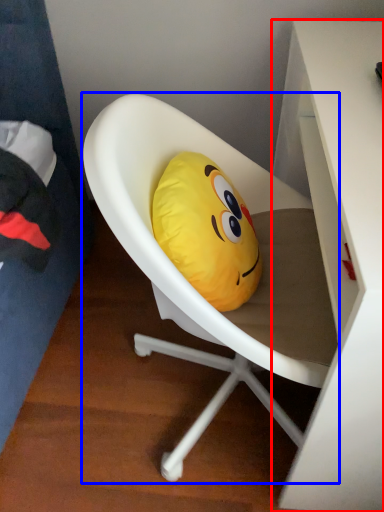
Question: Among these objects, which one is farthest to the camera, desk (highlighted by a red box) or chair (highlighted by a blue box)?

Choices:
 (A) desk
 (B) chair

Answer: (B)